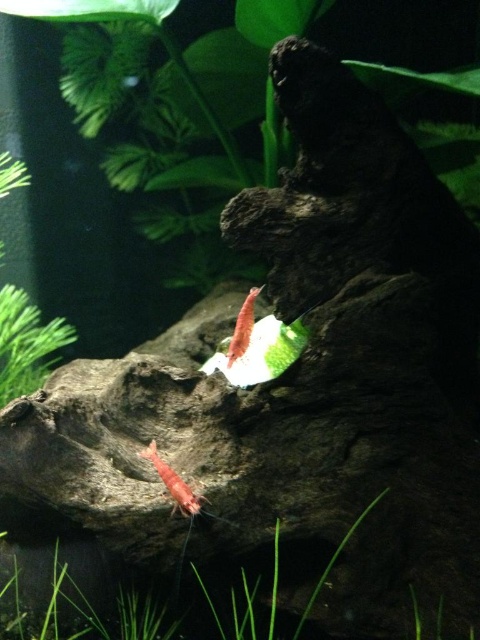
Question: Does green matte plant at lower center appear on the right side of translucent red shrimp at center?

Choices:
 (A) no
 (B) yes

Answer: (A)

Question: Which object is positioned farthest from the translucent pink shrimp at center?

Choices:
 (A) green matte plant at lower center
 (B) green matte plant at upper left

Answer: (B)

Question: From the image, what is the correct spatial relationship of green matte plant at lower center in relation to green matte plant at upper left?

Choices:
 (A) below
 (B) above

Answer: (A)

Question: Which point is closer to the camera?

Choices:
 (A) (274, 316)
 (B) (31, 330)
 (C) (1, 508)

Answer: (C)

Question: Which object appears closest to the camera in this image?

Choices:
 (A) green matte plant at lower center
 (B) green matte plant at upper left
 (C) translucent pink shrimp at center

Answer: (A)

Question: Can you confirm if green matte plant at upper left is positioned to the right of translucent red shrimp at center?

Choices:
 (A) yes
 (B) no

Answer: (B)